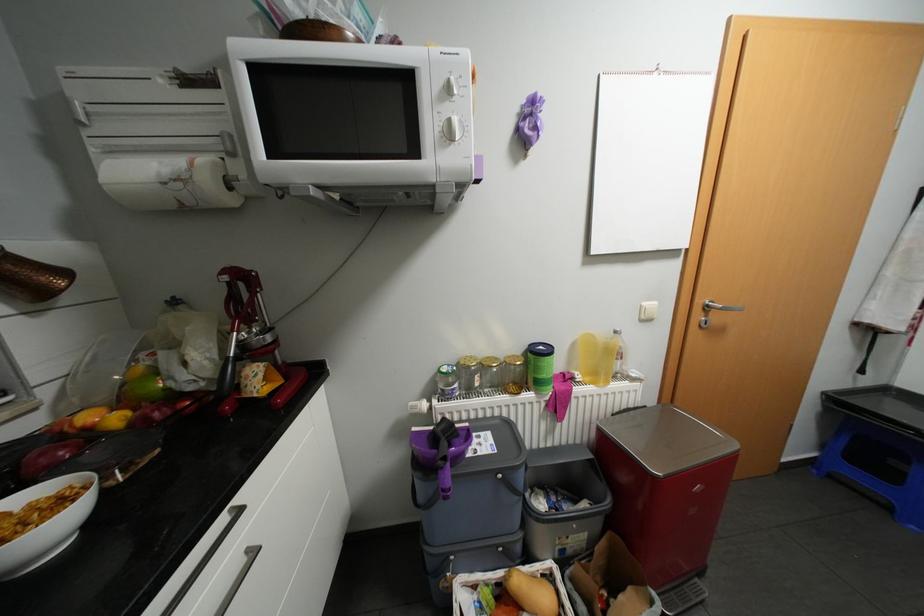
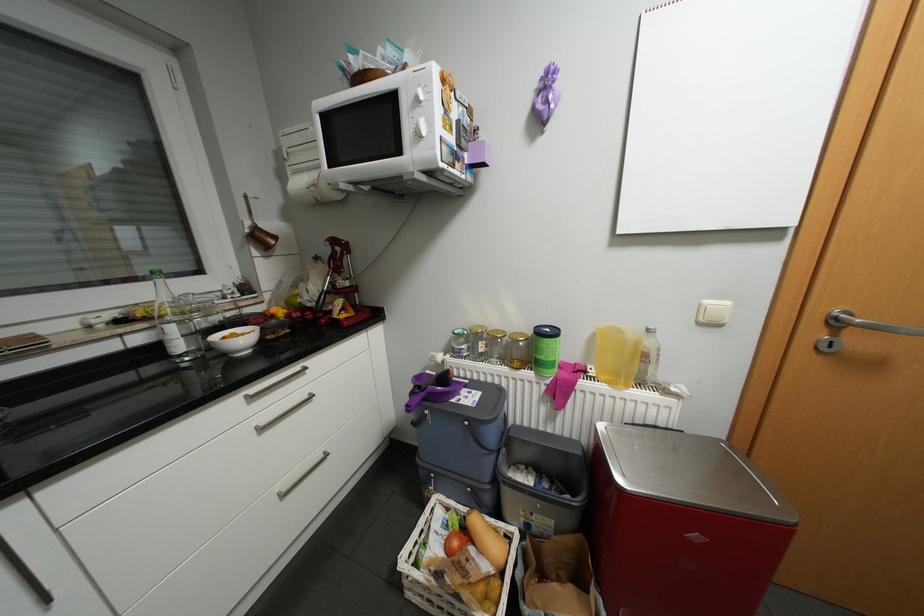
Locate, in the second image, the point that corresponds to (119,151) in the first image.

(302, 172)